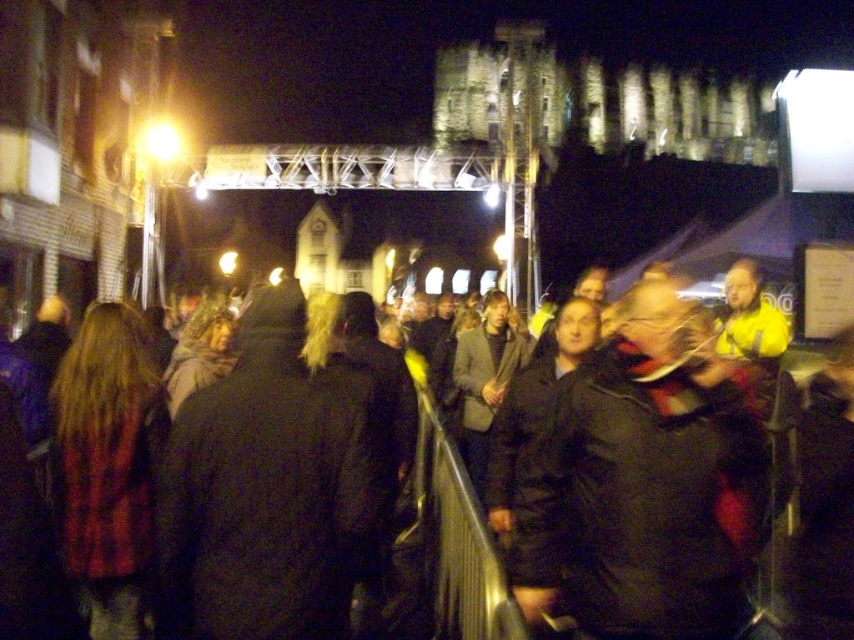
You are at an event and want to take a photo of the illuminated building. There are two people in front of you wearing dark gray jacket at center and dark wool coat at center. Which clothing item is closer to the left side of your view?

The dark gray jacket at center is to the left of dark wool coat at center, so the dark gray jacket at center is closer to the left side of your view.